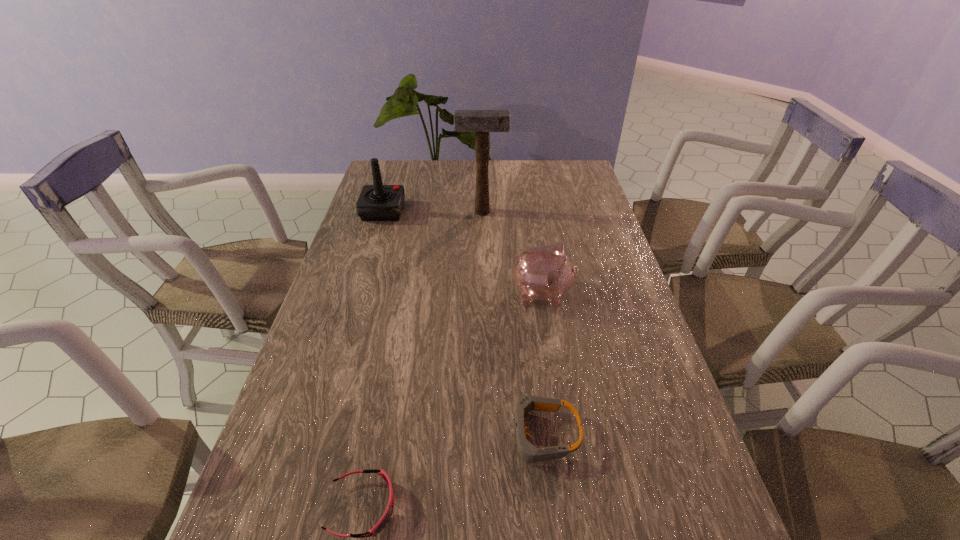
Image resolution: width=960 pixels, height=540 pixels. In order to click on unoccupied area between the right goggles and the joystick in this screenshot , I will do `click(463, 322)`.

Identify the location of free spot between the second tallest object and the mallet. (432, 211).

This screenshot has height=540, width=960. I want to click on object that is the third closest to the fourth farthest object, so click(481, 122).

Locate an element on the screen. This screenshot has width=960, height=540. object that is the third closest to the tallest object is located at coordinates (528, 452).

Identify the location of free space that satisfies the following two spatial constraints: 1. on the front facing side of the piggy bank; 2. on the front side of the mallet. (530, 212).

At what (x,y) coordinates should I click in order to perform the action: click on free space that satisfies the following two spatial constraints: 1. on the front-facing side of the joystick; 2. on the back side of the mallet. Please return your answer as a coordinate pair (x, y). The height and width of the screenshot is (540, 960). Looking at the image, I should click on (383, 212).